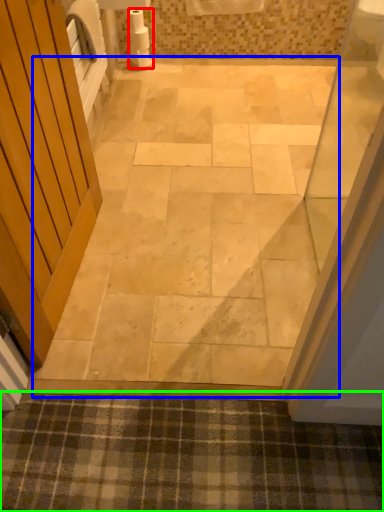
Question: Based on their relative distances, which object is farther from toilet paper (highlighted by a red box)? Choose from path (highlighted by a blue box) and bath mat (highlighted by a green box).

Choices:
 (A) path
 (B) bath mat

Answer: (B)